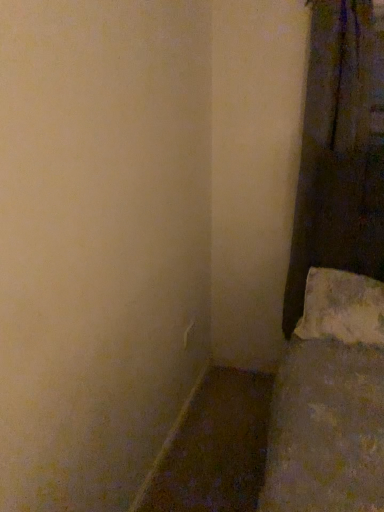
Question: From the image's perspective, would you say matte brown wood at lower left is shown under white textured pillow at lower right?

Choices:
 (A) no
 (B) yes

Answer: (B)

Question: From a real-world perspective, is matte brown wood at lower left positioned under white textured pillow at lower right based on gravity?

Choices:
 (A) no
 (B) yes

Answer: (B)

Question: Is matte brown wood at lower left to the left of white textured pillow at lower right from the viewer's perspective?

Choices:
 (A) yes
 (B) no

Answer: (A)

Question: Is matte brown wood at lower left placed right next to white textured pillow at lower right?

Choices:
 (A) no
 (B) yes

Answer: (A)

Question: Is matte brown wood at lower left aimed at white textured pillow at lower right?

Choices:
 (A) yes
 (B) no

Answer: (B)

Question: Choose the correct answer: Is matte brown wood at lower left inside white textured pillow at lower right or outside it?

Choices:
 (A) inside
 (B) outside

Answer: (B)

Question: From a real-world perspective, is matte brown wood at lower left positioned above or below white textured pillow at lower right?

Choices:
 (A) below
 (B) above

Answer: (A)

Question: In the image, is matte brown wood at lower left positioned in front of or behind white textured pillow at lower right?

Choices:
 (A) front
 (B) behind

Answer: (A)

Question: Considering the positions of matte brown wood at lower left and white textured pillow at lower right in the image, is matte brown wood at lower left bigger or smaller than white textured pillow at lower right?

Choices:
 (A) big
 (B) small

Answer: (B)

Question: Do you think white textured pillow at lower right is within matte brown wood at lower left, or outside of it?

Choices:
 (A) inside
 (B) outside

Answer: (B)

Question: From a real-world perspective, relative to matte brown wood at lower left, is white textured pillow at lower right vertically above or below?

Choices:
 (A) above
 (B) below

Answer: (A)

Question: Relative to matte brown wood at lower left, is white textured pillow at lower right in front or behind?

Choices:
 (A) front
 (B) behind

Answer: (B)

Question: From the image's perspective, is white textured pillow at lower right above or below matte brown wood at lower left?

Choices:
 (A) below
 (B) above

Answer: (B)

Question: Considering their positions, is matte brown wood at lower left located in front of or behind dark fabric curtain at right?

Choices:
 (A) front
 (B) behind

Answer: (A)

Question: Which is correct: matte brown wood at lower left is inside dark fabric curtain at right, or outside of it?

Choices:
 (A) outside
 (B) inside

Answer: (A)